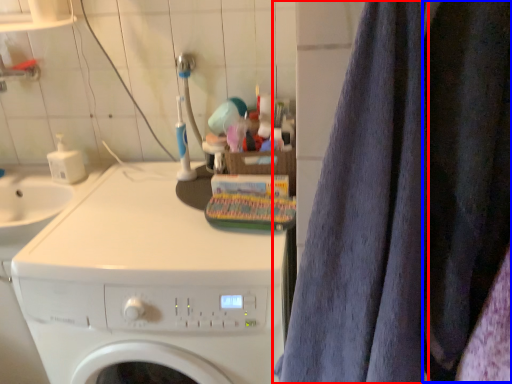
Question: Which object is further to the camera taking this photo, bath towel (highlighted by a red box) or clothing (highlighted by a blue box)?

Choices:
 (A) bath towel
 (B) clothing

Answer: (B)